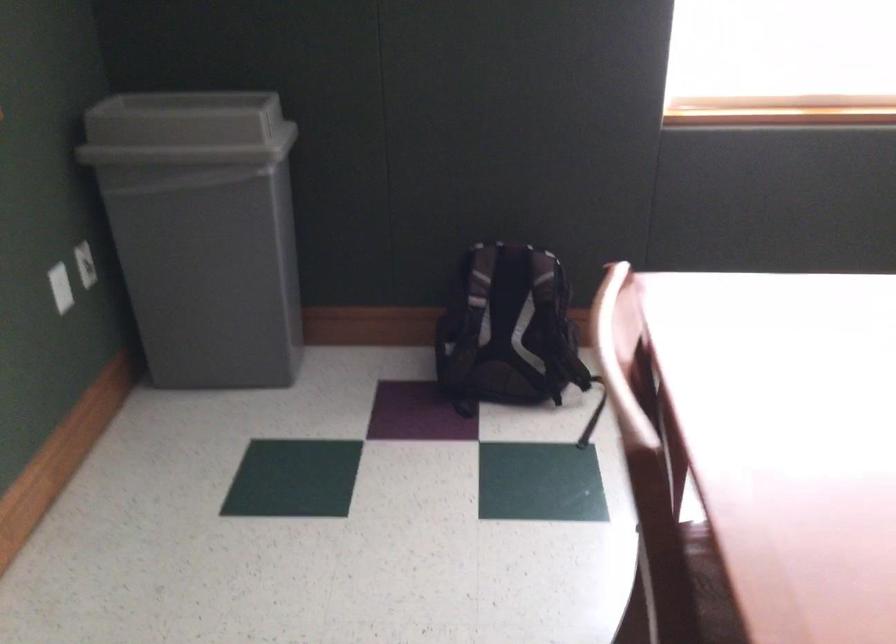
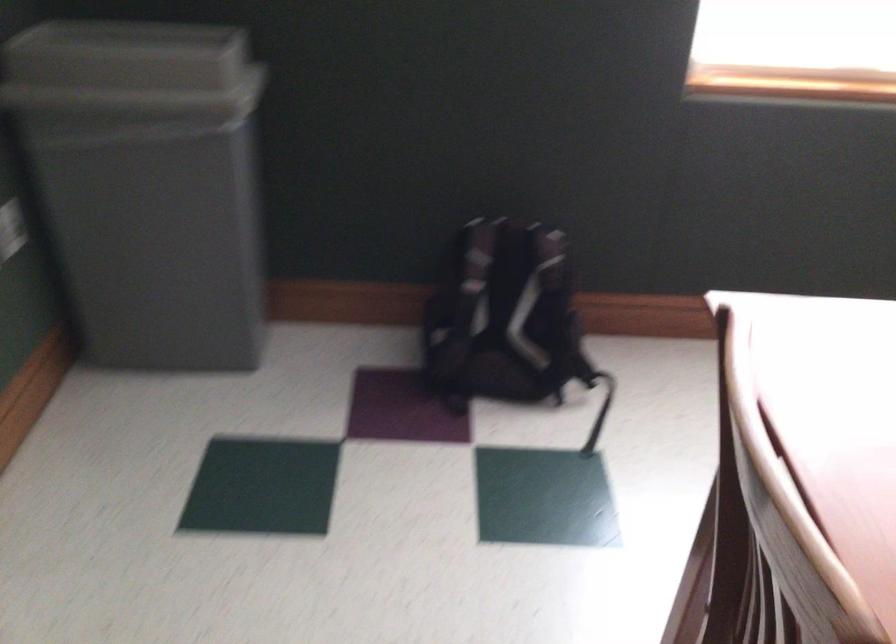
The point at (179, 129) is marked in the first image. Where is the corresponding point in the second image?

(131, 71)